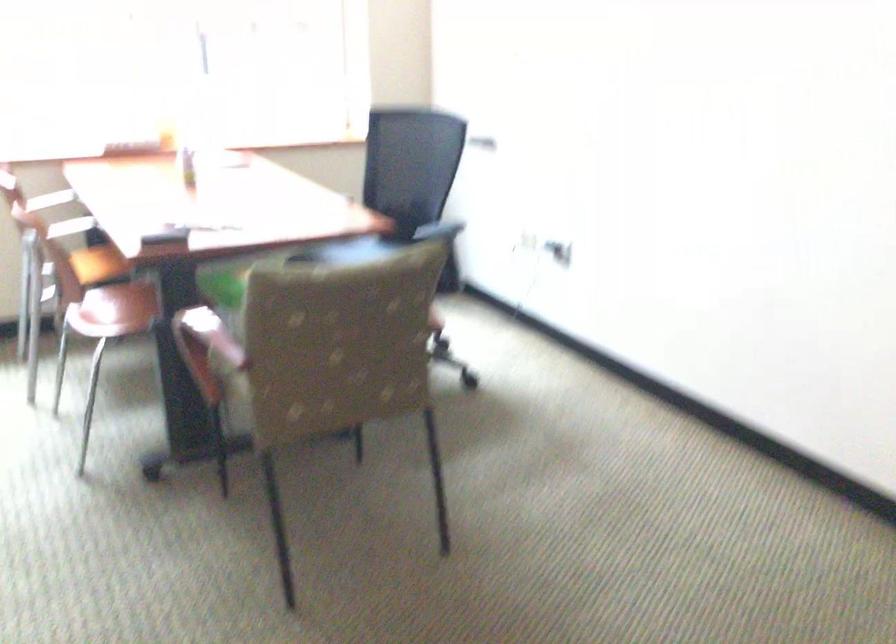
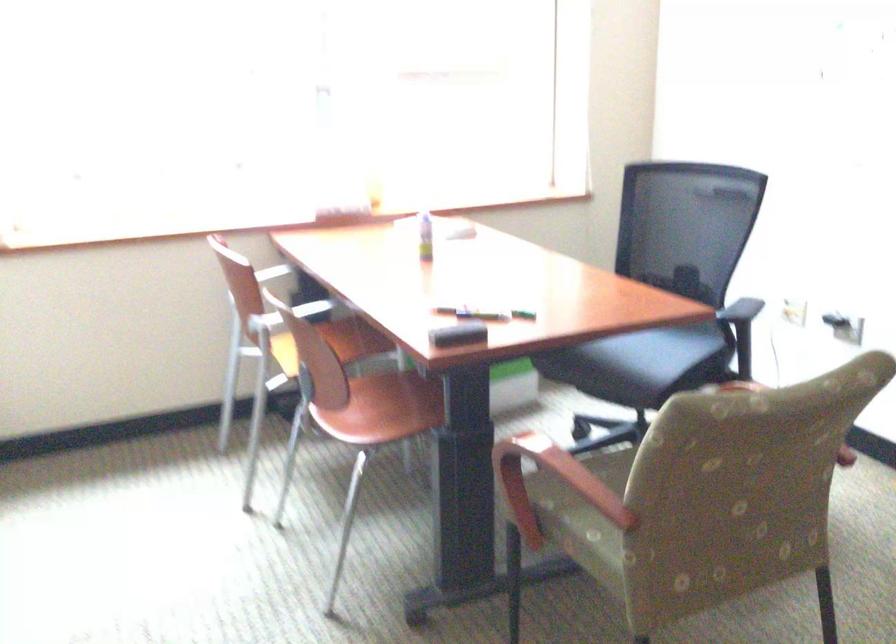
Locate, in the second image, the point that corresponds to (141,140) in the first image.

(346, 214)